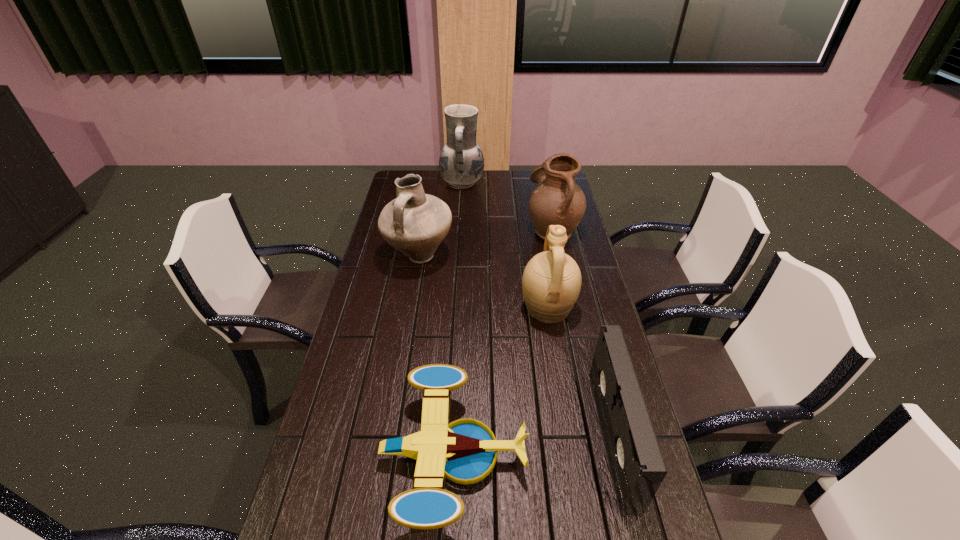
Locate an element on the screen. videotape that is at the right edge is located at coordinates (637, 467).

In the image, there is a desktop. Where is `vacant space at the far edge`? The height and width of the screenshot is (540, 960). vacant space at the far edge is located at coordinates (500, 185).

Identify the location of vacant space at the left edge of the desktop. (372, 314).

At what (x,y) coordinates should I click in order to perform the action: click on blank space at the right edge of the desktop. Please return your answer as a coordinate pair (x, y). The image size is (960, 540). Looking at the image, I should click on (612, 495).

At what (x,y) coordinates should I click in order to perform the action: click on free space between the farthest pitcher and the fourth farthest object. Please return your answer as a coordinate pair (x, y). The height and width of the screenshot is (540, 960). Looking at the image, I should click on (505, 246).

The width and height of the screenshot is (960, 540). I want to click on free space between the fourth farthest object and the fifth tallest object, so click(x=580, y=373).

Image resolution: width=960 pixels, height=540 pixels. What are the coordinates of `object that can be found as the closest to the third nearest object` in the screenshot? It's located at (637, 467).

You are a GUI agent. You are given a task and a screenshot of the screen. Output one action in this format:
    pyautogui.click(x=<x>, y=<y>)
    Task: Click on the object that is the fifth nearest to the shortest object
    
    Given the screenshot: What is the action you would take?
    pyautogui.click(x=461, y=163)

The height and width of the screenshot is (540, 960). Find the location of `pitcher that is the second closest one to the third nearest object`. pitcher that is the second closest one to the third nearest object is located at coordinates (415, 223).

Identify which pitcher is located as the second nearest to the farthest object. Please provide its 2D coordinates. Your answer should be formatted as a tuple, i.e. [(x, y)], where the tuple contains the x and y coordinates of a point satisfying the conditions above.

[(415, 223)]